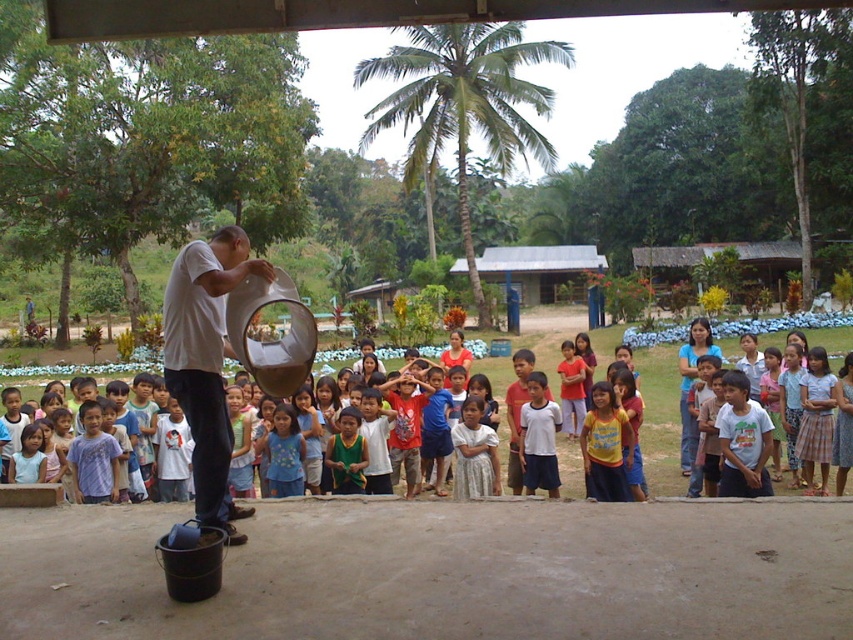
You are a photographer trying to capture a photo of the yellow cotton shirt at center and the white matte bucket at center. Which object should you focus on first if you want to include both in your shot without moving the camera?

The white matte bucket at center is positioned on the left side of the yellow cotton shirt at center, so you should focus on the white matte bucket at center first to ensure both are in frame.

You are a photographer trying to capture the white matte bucket at center and the yellow cotton shirt at center in the same frame. Based on their positions, which object should you focus on first to ensure both are in focus?

The white matte bucket at center is in front of the yellow cotton shirt at center, so you should focus on the white matte bucket at center first to ensure both are in focus.

You are a photographer trying to capture a clear photo of both the yellow cotton shirt at center and the white cotton shirt at center. Which one will appear larger in the photo?

The yellow cotton shirt at center will appear larger in the photo because it is closer to the viewer than the white cotton shirt at center.